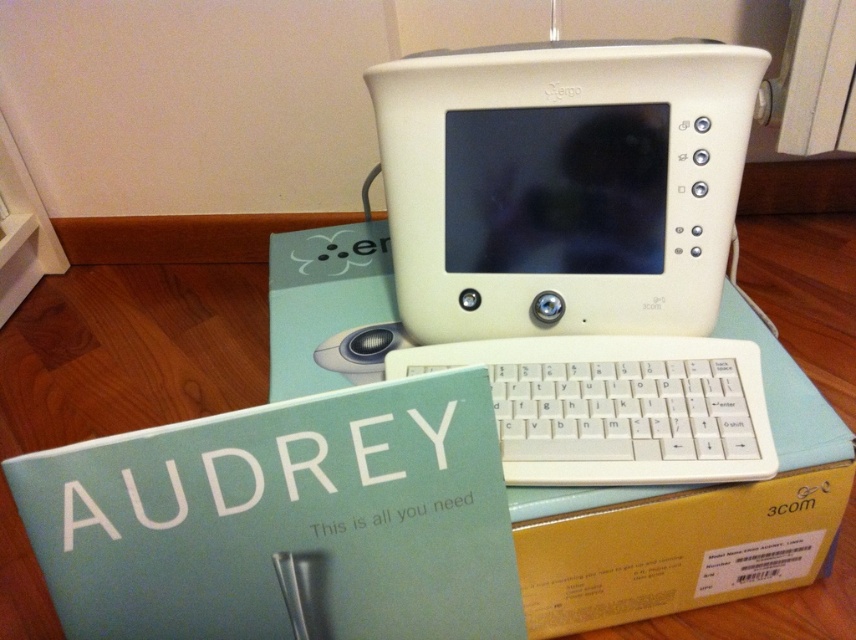
Is cardboard box at center positioned at the back of white plastic mouse at center?

No.

Is point (521, 502) positioned in front of point (336, 349)?

Yes, point (521, 502) is in front of point (336, 349).

Measure the distance between cardboard box at center and camera.

cardboard box at center is 22.67 inches from camera.

Find the location of a particular element. cardboard box at center is located at coordinates (691, 516).

Who is more distant from viewer, [140,577] or [363,368]?

The point [363,368] is more distant.

Is matte white book at center positioned in front of white plastic mouse at center?

That is True.

In order to click on matte white book at center in this screenshot , I will do `click(284, 522)`.

Identify the location of matte white book at center. (284, 522).

Is white plastic keyboard at center shorter than white plastic mouse at center?

No, white plastic keyboard at center is not shorter than white plastic mouse at center.

Who is higher up, white plastic keyboard at center or white plastic mouse at center?

Positioned higher is white plastic mouse at center.

Image resolution: width=856 pixels, height=640 pixels. I want to click on white plastic keyboard at center, so click(x=616, y=406).